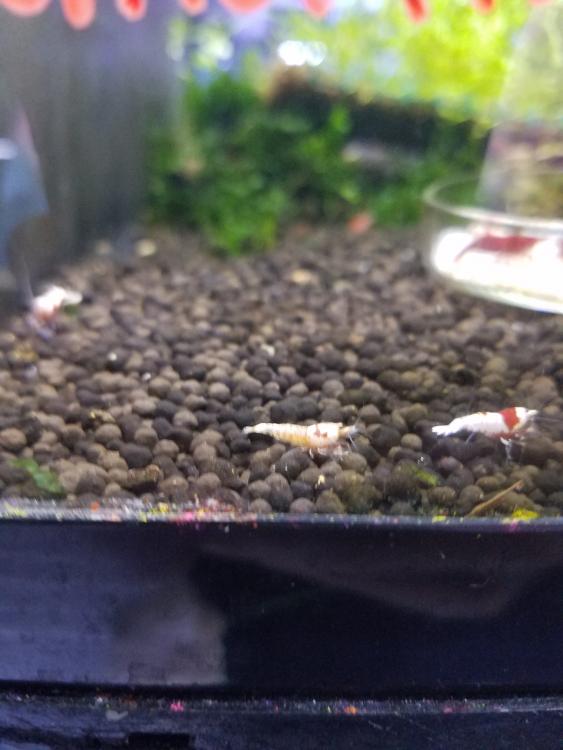
Find the location of a particular element. Image resolution: width=563 pixels, height=750 pixels. bowl is located at coordinates (521, 272).